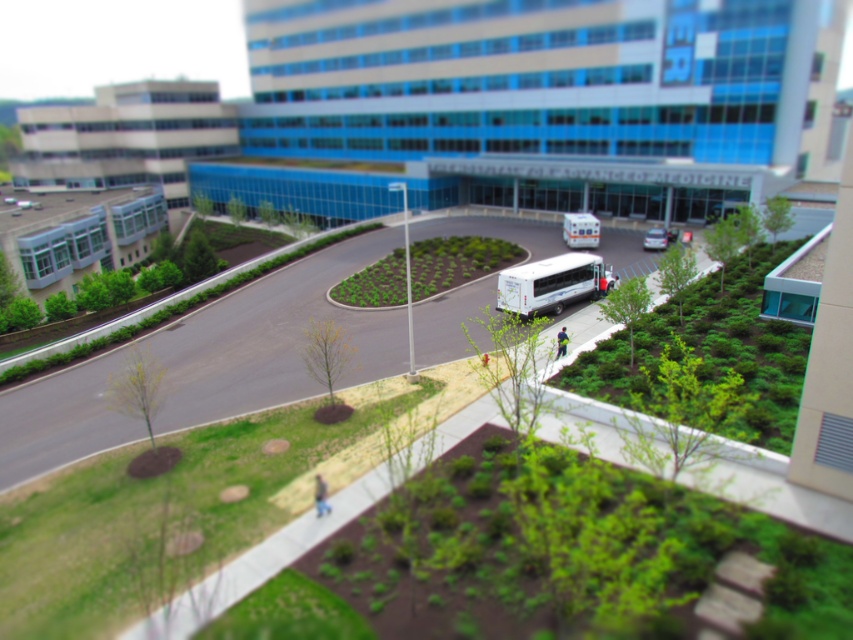
Question: Is white matte bus at center smaller than white glossy bus at center?

Choices:
 (A) yes
 (B) no

Answer: (B)

Question: From the image, what is the correct spatial relationship of white matte bus at center in relation to silver metallic van at center?

Choices:
 (A) left
 (B) right

Answer: (A)

Question: Is white matte bus at center thinner than white glossy bus at center?

Choices:
 (A) no
 (B) yes

Answer: (A)

Question: Which object is farther from the camera taking this photo?

Choices:
 (A) white glossy bus at center
 (B) silver metallic van at center

Answer: (A)

Question: Which of these objects is positioned farthest from the white matte bus at center?

Choices:
 (A) silver metallic van at center
 (B) white glossy bus at center

Answer: (A)

Question: Which point is closer to the camera?

Choices:
 (A) (650, 230)
 (B) (601, 257)
 (C) (593, 236)

Answer: (B)